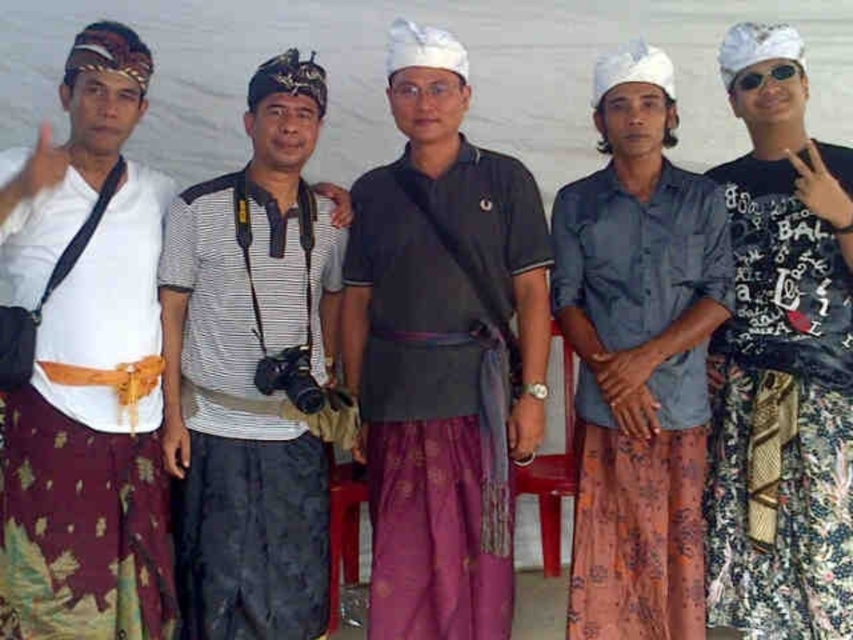
You are a photographer trying to capture a candid shot of the dark gray cotton shirt at center without the sunglasses at right appearing in the frame. Is this possible given their current positions?

The dark gray cotton shirt at center is positioned under the sunglasses at right, so if you angle your camera downward towards the dark gray cotton shirt at center, you can avoid the sunglasses at right appearing in the frame.

You are standing in front of the group of five individuals dressed in traditional attire. There are two points marked on the image at coordinates point (828, 397) and point (734, 83). Which of these points is nearer to you?

Point (828, 397) is closer to the viewer than point (734, 83).

You are a photographer trying to capture a group photo of the dark gray cotton shirt at center and the floral fabric skirt at right. Since you want to ensure both subjects are in focus, you need to know their positions relative to each other. Can you tell me which one is positioned more to the left?

The dark gray cotton shirt at center is to the left of the floral fabric skirt at right, so the dark gray cotton shirt at center is positioned more to the left.